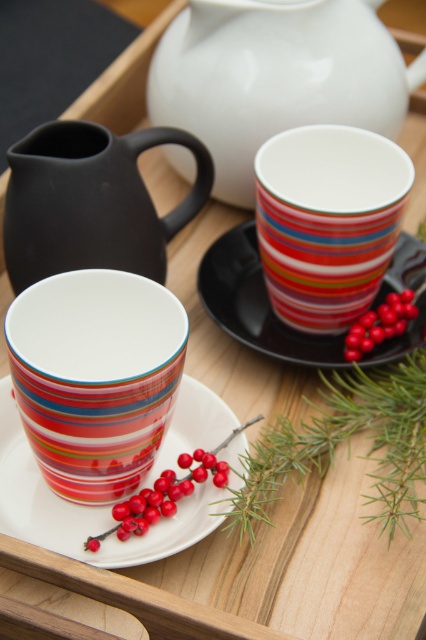
Question: Which point is farther to the camera?

Choices:
 (A) (92, 136)
 (B) (215, 243)

Answer: (B)

Question: Does white glossy teapot at upper center appear on the right side of matte ceramic mug at center?

Choices:
 (A) yes
 (B) no

Answer: (A)

Question: Which of these objects is positioned closest to the smooth glossy berries at center?

Choices:
 (A) white ceramic plate at center
 (B) white glossy teapot at upper center

Answer: (A)

Question: Observing the image, what is the correct spatial positioning of white glossy teapot at upper center in reference to smooth glossy berries at center?

Choices:
 (A) above
 (B) below

Answer: (A)

Question: Is multicolored striped mug at upper right wider than glossy red berries at center right?

Choices:
 (A) yes
 (B) no

Answer: (A)

Question: Which point is closer to the camera?

Choices:
 (A) multicolored striped mug at upper right
 (B) black glossy saucer at center
 (C) matte black pitcher at upper left

Answer: (C)